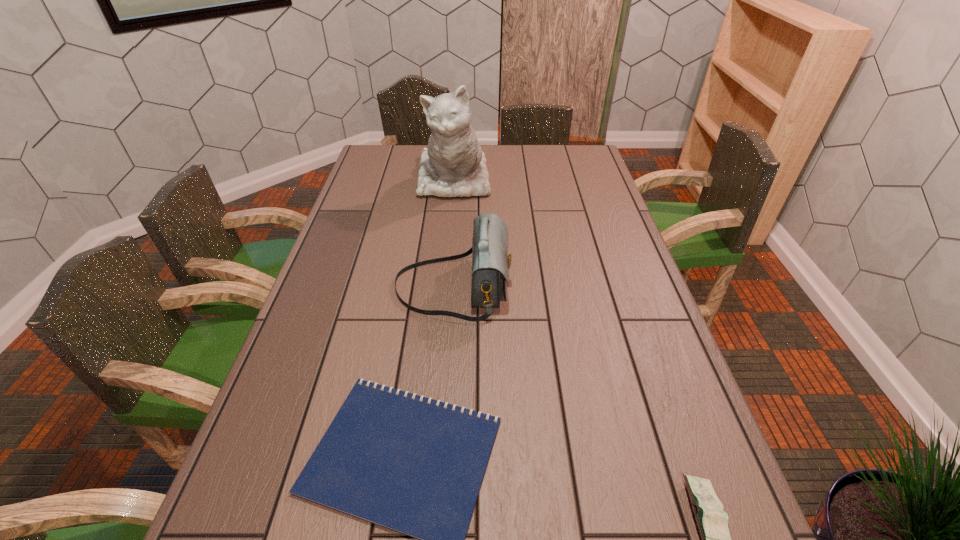
The width and height of the screenshot is (960, 540). In the image, there is a desktop. What are the coordinates of `vacant space at the far right corner` in the screenshot? It's located at (595, 158).

What are the coordinates of `vacant space that is in between the second farthest object and the tallest object` in the screenshot? It's located at click(453, 233).

In order to click on blank region between the second tallest object and the tallest object in this screenshot , I will do 453,233.

This screenshot has width=960, height=540. Find the location of `vacant point located between the cat and the second tallest object`. vacant point located between the cat and the second tallest object is located at coordinates (453, 233).

Identify the location of the closest object relative to the tallest object. (490, 261).

This screenshot has height=540, width=960. Identify the location of the closest object to the tallest object. (490, 261).

The image size is (960, 540). Find the location of `vacant space that satisfies the following two spatial constraints: 1. on the front-facing side of the shoulder bag; 2. on the right side of the cat`. vacant space that satisfies the following two spatial constraints: 1. on the front-facing side of the shoulder bag; 2. on the right side of the cat is located at coordinates (444, 286).